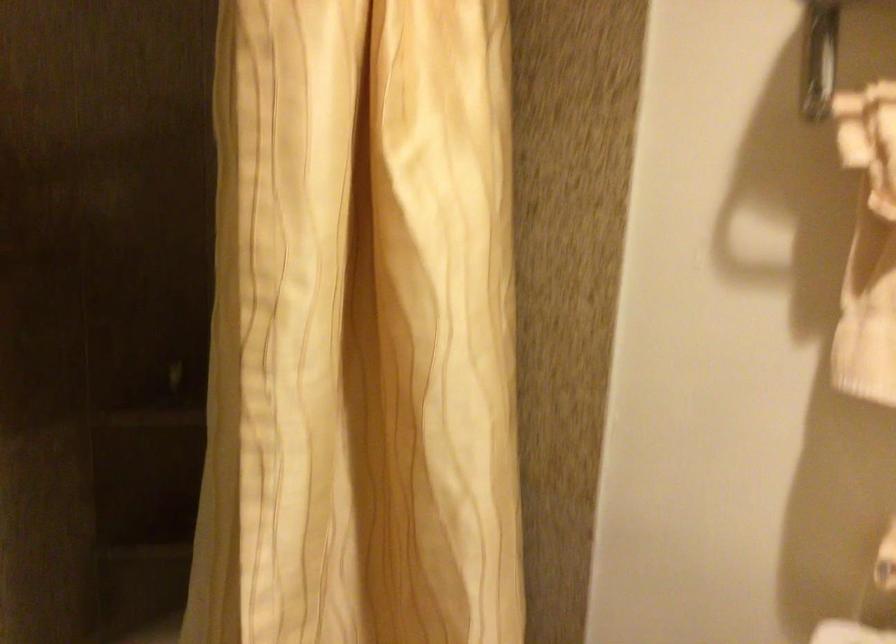
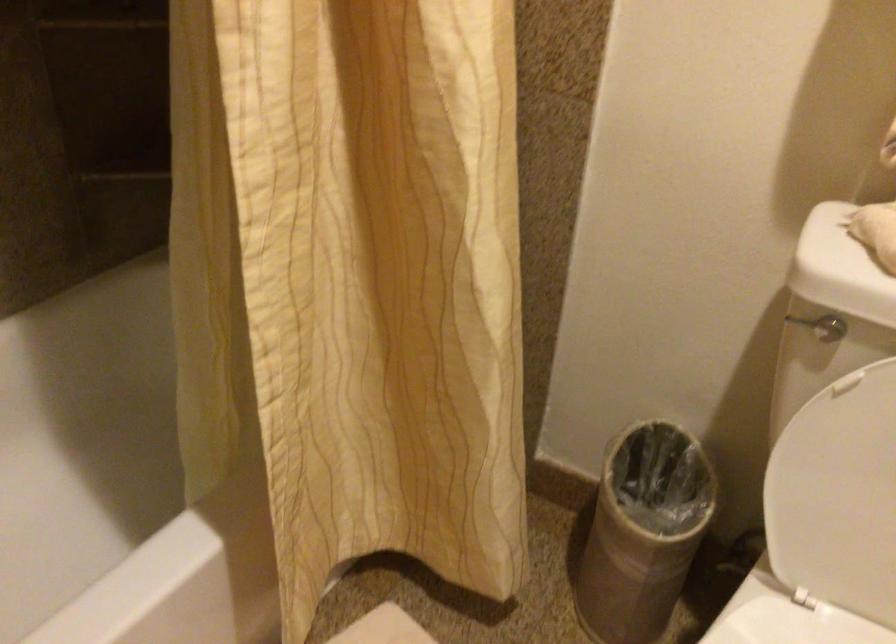
In a continuous first-person perspective shot, in which direction is the camera moving?

The cameraman moved toward left, forward.